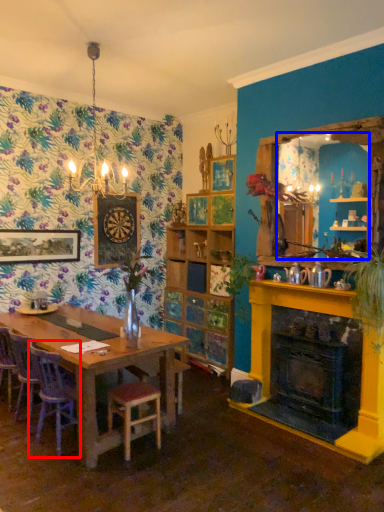
Question: Which of the following is the farthest to the observer, chair (highlighted by a red box) or mirror (highlighted by a blue box)?

Choices:
 (A) chair
 (B) mirror

Answer: (B)